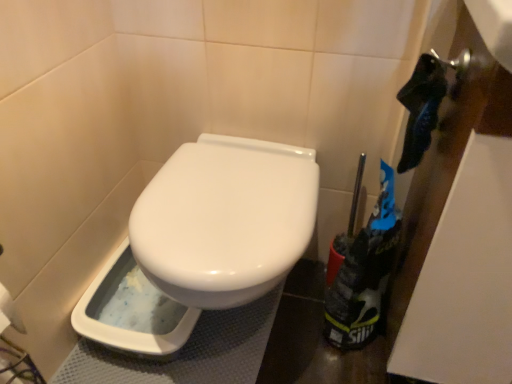
You are a GUI agent. You are given a task and a screenshot of the screen. Output one action in this format:
    pyautogui.click(x=<x>, y=<y>)
    Task: Click on the vacant space to the right of white plastic bidet at lower left
    The height and width of the screenshot is (384, 512).
    Given the screenshot: What is the action you would take?
    pyautogui.click(x=238, y=343)